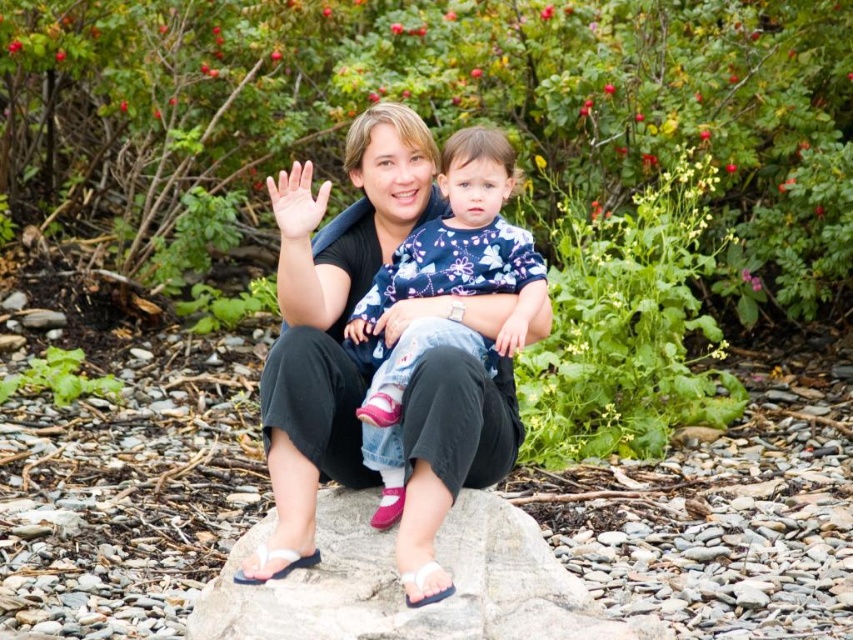
Is gray smooth rock at center behind floral-patterned fabric at center?

No, gray smooth rock at center is closer to the viewer.

Who is more distant from viewer, (x=384, y=582) or (x=457, y=212)?

The point (x=457, y=212) is behind.

This screenshot has height=640, width=853. What are the coordinates of `gray smooth rock at center` in the screenshot? It's located at (399, 582).